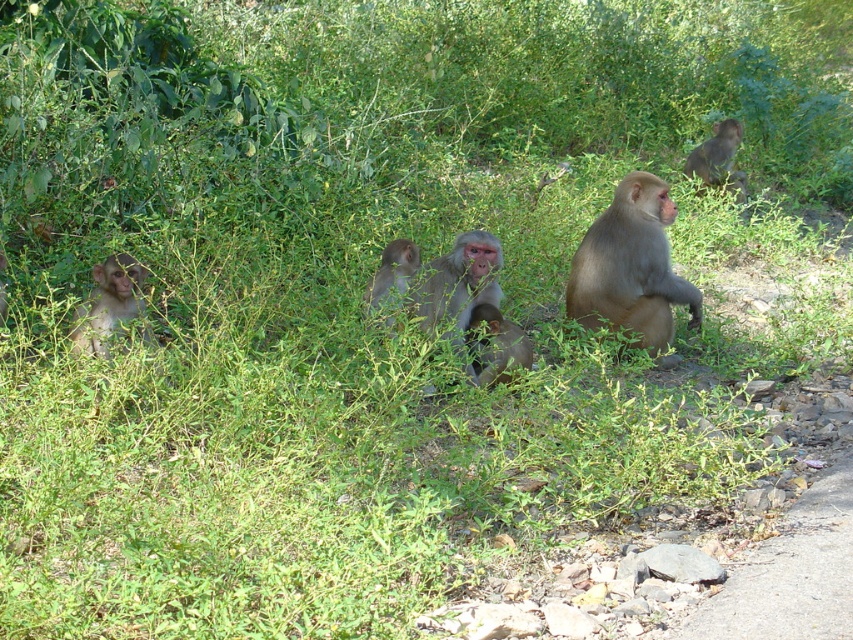
Question: Which point is closer to the camera taking this photo?

Choices:
 (A) (459, 332)
 (B) (96, 344)
 (C) (708, 166)
 (D) (370, 291)

Answer: (B)

Question: From the image, what is the correct spatial relationship of brown furry monkey at center in relation to brown furry monkey at upper right?

Choices:
 (A) below
 (B) above

Answer: (A)

Question: Which object appears closest to the camera in this image?

Choices:
 (A) brown furry monkey at center
 (B) brown fur monkey at center
 (C) gray fur monkey at center

Answer: (B)

Question: Among these objects, which one is farthest from the camera?

Choices:
 (A) gray fur monkey at center
 (B) light brown fur monkey at center

Answer: (B)

Question: Observing the image, what is the correct spatial positioning of light brown fur monkey at center in reference to brown fur monkey at center?

Choices:
 (A) left
 (B) right

Answer: (B)

Question: Is the position of light brown fur monkey at center more distant than that of brown fur monkey at center?

Choices:
 (A) yes
 (B) no

Answer: (A)